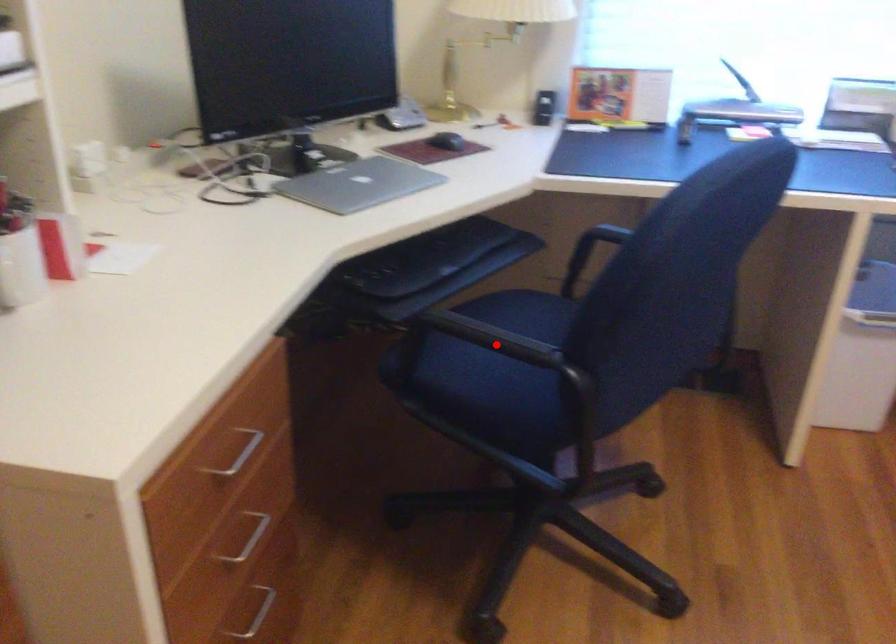
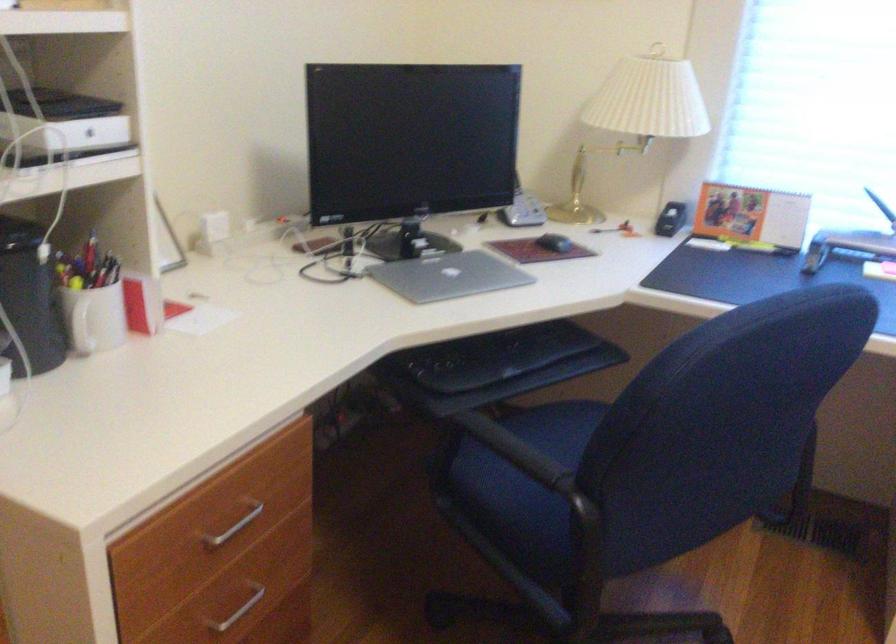
Locate, in the second image, the point that corresponds to the highlighted location in the first image.

(513, 450)